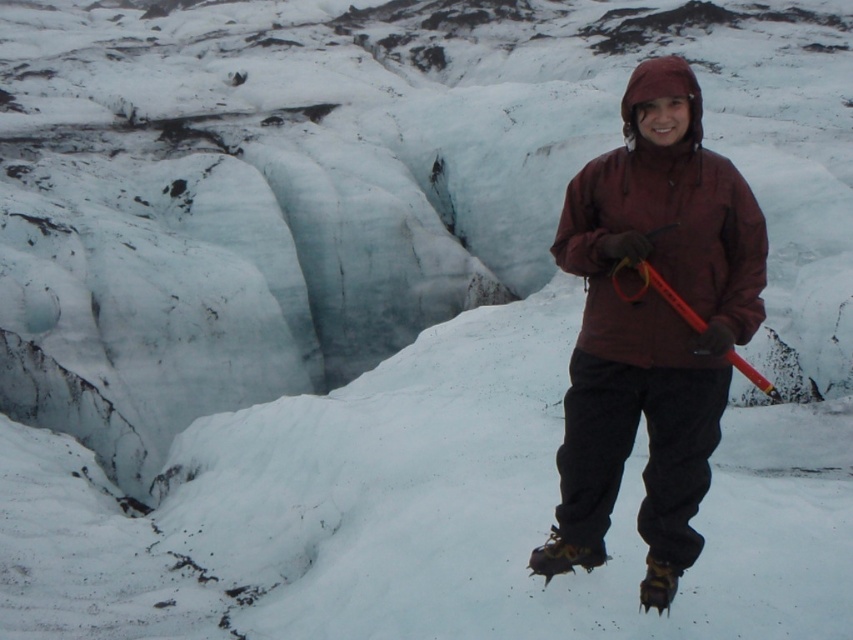
Question: Which point is farther to the camera?

Choices:
 (A) maroon fleece jacket at center
 (B) orange plastic ski pole at center

Answer: (A)

Question: Which point is farther to the camera?

Choices:
 (A) (624, 260)
 (B) (653, 218)

Answer: (B)

Question: Where is maroon fleece jacket at center located in relation to orange plastic ski pole at center in the image?

Choices:
 (A) right
 (B) left

Answer: (A)

Question: Can you confirm if maroon fleece jacket at center is wider than orange plastic ski pole at center?

Choices:
 (A) no
 (B) yes

Answer: (B)

Question: Which point is closer to the camera?

Choices:
 (A) (715, 294)
 (B) (671, 288)

Answer: (A)

Question: Can you confirm if maroon fleece jacket at center is positioned to the right of orange plastic ski pole at center?

Choices:
 (A) no
 (B) yes

Answer: (B)